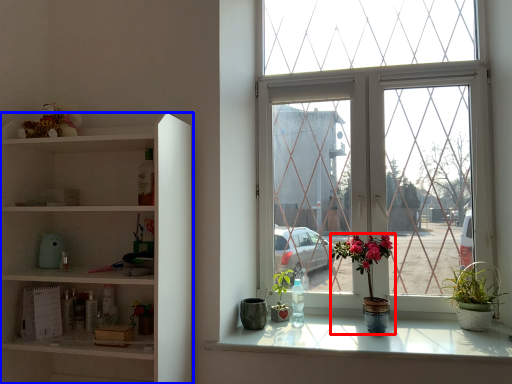
Question: Which object is further to the camera taking this photo, houseplant (highlighted by a red box) or shelf (highlighted by a blue box)?

Choices:
 (A) houseplant
 (B) shelf

Answer: (A)